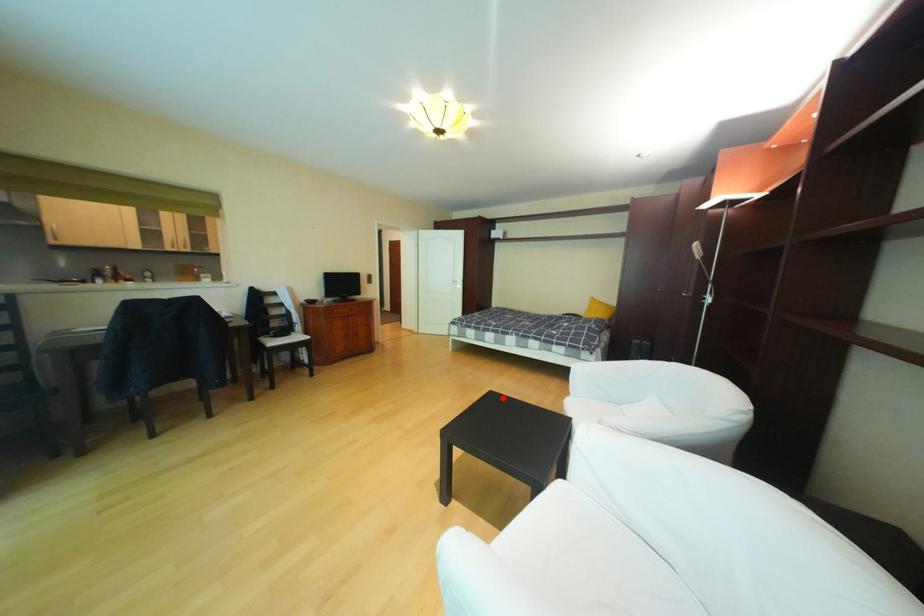
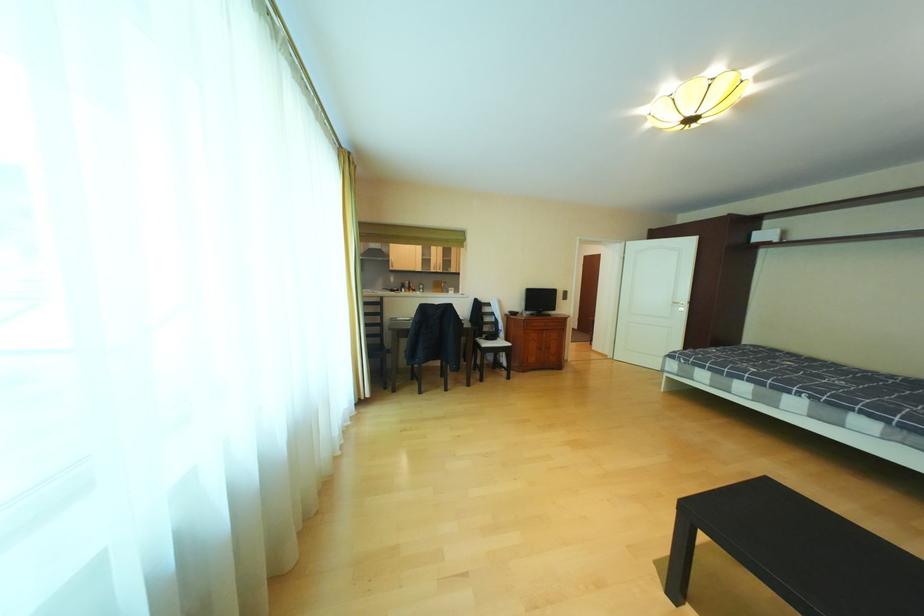
Find the pixel in the second image that matches the highlighted location in the first image.

(782, 488)